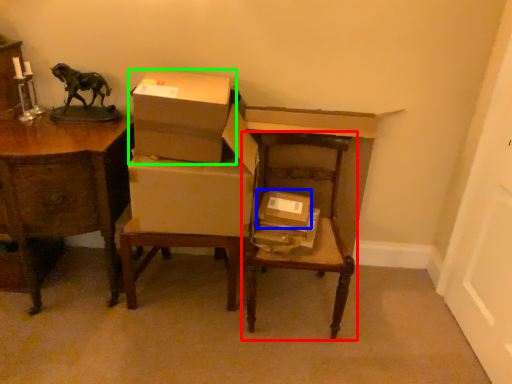
Question: Estimate the real-world distances between objects in this image. Which object is farther from chair (highlighted by a red box), box (highlighted by a blue box) or box (highlighted by a green box)?

Choices:
 (A) box
 (B) box

Answer: (B)